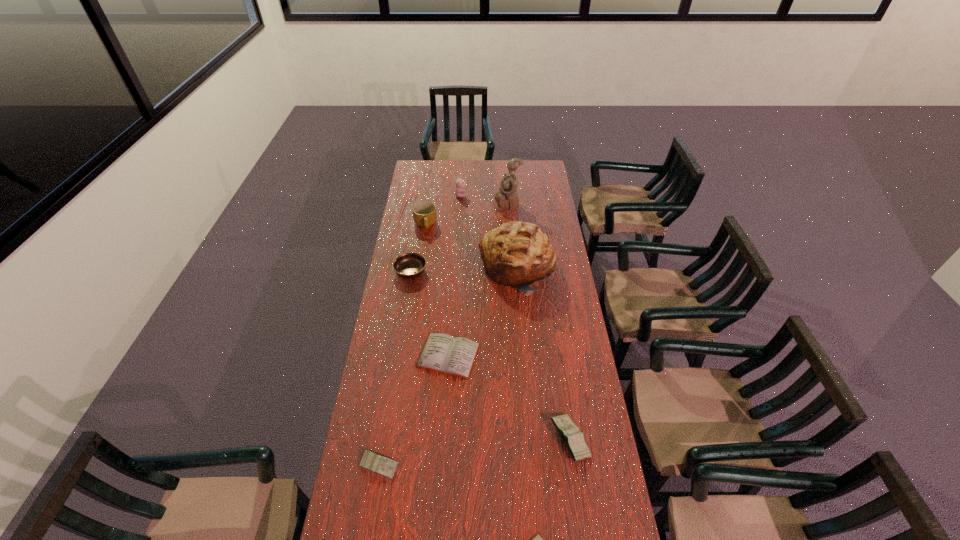
Locate an element on the screen. figurine is located at coordinates (507, 198).

Where is `white figurine`? white figurine is located at coordinates (507, 198).

Where is `bread`? This screenshot has width=960, height=540. bread is located at coordinates (516, 254).

In order to click on pink teddy bear in this screenshot , I will do `click(459, 192)`.

The height and width of the screenshot is (540, 960). What are the coordinates of `the fourth tallest object` in the screenshot? It's located at (424, 213).

The width and height of the screenshot is (960, 540). I want to click on the third farthest object, so click(x=424, y=213).

Locate an element on the screen. soup bowl is located at coordinates (410, 265).

I want to click on the right pink diary, so click(x=574, y=441).

Find the location of a particular element. This screenshot has height=540, width=960. the tallest diary is located at coordinates (574, 441).

The width and height of the screenshot is (960, 540). Identify the location of the seventh tallest object. (375, 462).